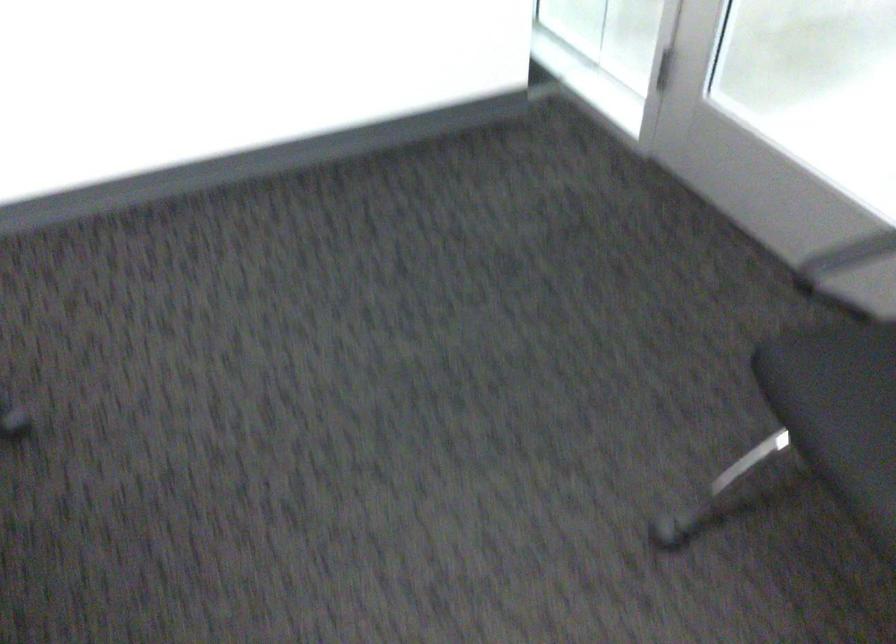
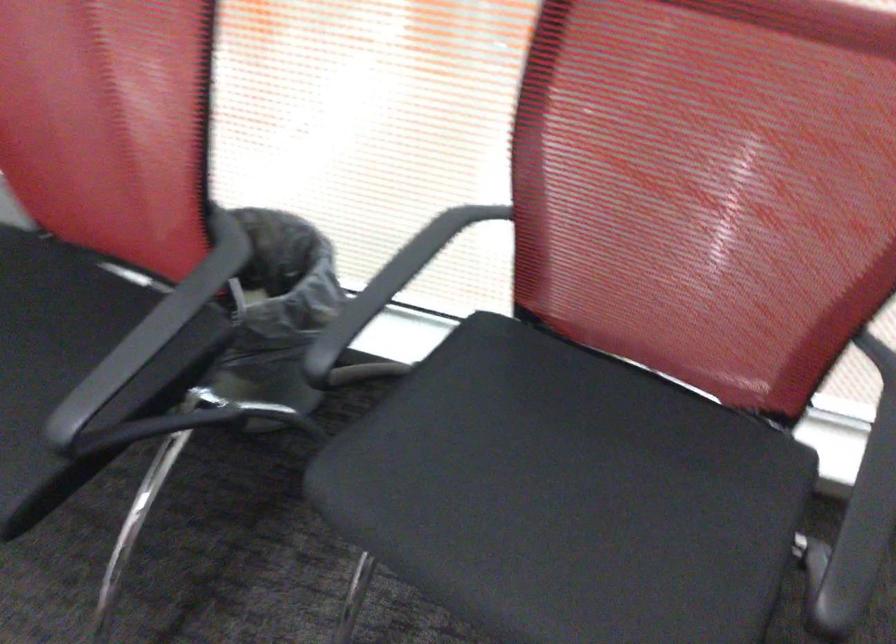
Question: The camera is either moving clockwise (left) or counter-clockwise (right) around the object. The first image is from the beginning of the video and the second image is from the end. Is the camera moving left or right when shooting the video?

Choices:
 (A) Left
 (B) Right

Answer: (A)